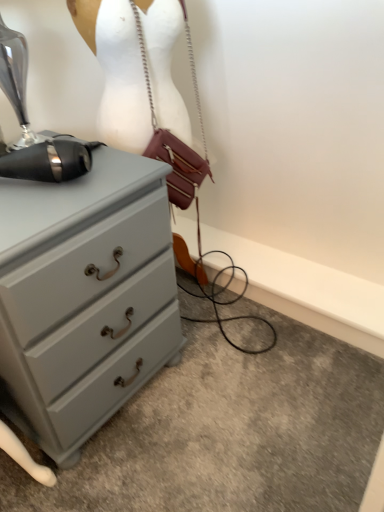
At what (x,y) coordinates should I click in order to perform the action: click on vacant area that is situated to the right of white matte mannequin at upper center. Please return your answer as a coordinate pair (x, y). Looking at the image, I should click on (224, 314).